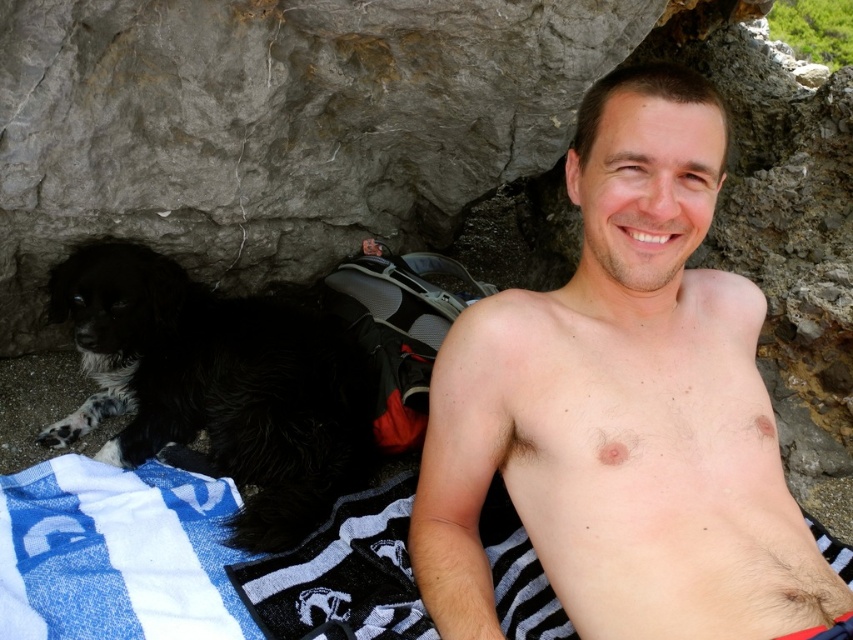
You are a photographer wanting to capture the man and his dog in the scene. Since the hairless skin at center and black fluffy dog at left are both in the frame, can you determine which one is closer to the camera based on their positions?

The hairless skin at center is located above the black fluffy dog at left, so the hairless skin at center is closer to the camera.

What is the exact coordinate of the hairless skin at center?

The hairless skin at center is located at point (624, 408).